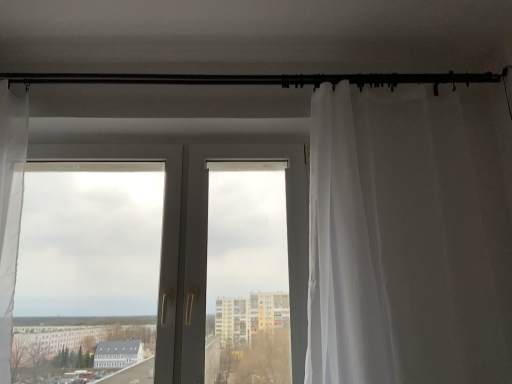
The image size is (512, 384). What do you see at coordinates (410, 236) in the screenshot? I see `sheer white curtain at right` at bounding box center [410, 236].

What do you see at coordinates (204, 238) in the screenshot? Image resolution: width=512 pixels, height=384 pixels. I see `white plastic door at center` at bounding box center [204, 238].

Locate an element on the screen. Image resolution: width=512 pixels, height=384 pixels. black metal rod at upper center is located at coordinates (259, 79).

How much distance is there between sheer white curtain at right and white plastic door at center?

sheer white curtain at right is 19.02 inches from white plastic door at center.

Based on the photo, considering the relative sizes of sheer white curtain at right and white plastic door at center in the image provided, is sheer white curtain at right shorter than white plastic door at center?

No.

Would you say sheer white curtain at right is outside white plastic door at center?

sheer white curtain at right lies outside white plastic door at center's area.

Considering the sizes of objects sheer white curtain at right and white plastic door at center in the image provided, who is wider, sheer white curtain at right or white plastic door at center?

Wider between the two is sheer white curtain at right.

Is point (189, 78) closer or farther from the camera than point (361, 214)?

Clearly, point (189, 78) is more distant from the camera than point (361, 214).

Is black metal rod at upper center oriented away from sheer white curtain at right?

No.

From a real-world perspective, who is located lower, black metal rod at upper center or sheer white curtain at right?

sheer white curtain at right.

Does sheer white curtain at right have a lesser width compared to black metal rod at upper center?

No.

In the scene shown: Choose the correct answer: Is sheer white curtain at right inside black metal rod at upper center or outside it?

sheer white curtain at right lies outside black metal rod at upper center.

Is sheer white curtain at right far from black metal rod at upper center?

Actually, sheer white curtain at right and black metal rod at upper center are a little close together.

Which is more to the right, sheer white curtain at right or black metal rod at upper center?

sheer white curtain at right is more to the right.

Can you confirm if white plastic door at center is wider than sheer white curtain at right?

In fact, white plastic door at center might be narrower than sheer white curtain at right.

From a real-world perspective, who is located higher, white plastic door at center or sheer white curtain at right?

In real-world perspective, sheer white curtain at right is above.

Is white plastic door at center in contact with sheer white curtain at right?

No, white plastic door at center is not in contact with sheer white curtain at right.

Is white plastic door at center located outside sheer white curtain at right?

Yes, white plastic door at center is outside of sheer white curtain at right.

Locate an element on the screen. The height and width of the screenshot is (384, 512). beam to the right of white plastic door at center is located at coordinates (259, 79).

Does point (372, 74) appear closer or farther from the camera than point (300, 305)?

Clearly, point (372, 74) is more distant from the camera than point (300, 305).

Would you say black metal rod at upper center is outside white plastic door at center?

Yes.

Which object is more forward, black metal rod at upper center or white plastic door at center?

white plastic door at center.

From the image's perspective, who appears lower, white plastic door at center or black metal rod at upper center?

white plastic door at center.

Would you say white plastic door at center is inside or outside black metal rod at upper center?

white plastic door at center cannot be found inside black metal rod at upper center.

Does point (301, 287) appear closer or farther from the camera than point (395, 73)?

Point (301, 287).

Identify the location of curtain above the white plastic door at center (from a real-world perspective). This screenshot has height=384, width=512. (410, 236).

This screenshot has width=512, height=384. Find the location of `curtain below the black metal rod at upper center (from a real-world perspective)`. curtain below the black metal rod at upper center (from a real-world perspective) is located at coordinates click(410, 236).

Looking at the image, which one is located closer to white plastic door at center, black metal rod at upper center or sheer white curtain at right?

sheer white curtain at right.

Consider the image. Estimate the real-world distances between objects in this image. Which object is closer to sheer white curtain at right, black metal rod at upper center or white plastic door at center?

white plastic door at center lies closer to sheer white curtain at right than the other object.

Which object lies nearer to the anchor point black metal rod at upper center, sheer white curtain at right or white plastic door at center?

sheer white curtain at right is closer to black metal rod at upper center.

Estimate the real-world distances between objects in this image. Which object is closer to white plastic door at center, sheer white curtain at right or black metal rod at upper center?

Based on the image, sheer white curtain at right appears to be nearer to white plastic door at center.

Looking at the image, which one is located closer to sheer white curtain at right, white plastic door at center or black metal rod at upper center?

Among the two, white plastic door at center is located nearer to sheer white curtain at right.

Which object lies nearer to the anchor point black metal rod at upper center, white plastic door at center or sheer white curtain at right?

sheer white curtain at right.

The height and width of the screenshot is (384, 512). Find the location of `beam between white plastic door at center and sheer white curtain at right from left to right`. beam between white plastic door at center and sheer white curtain at right from left to right is located at coordinates pos(259,79).